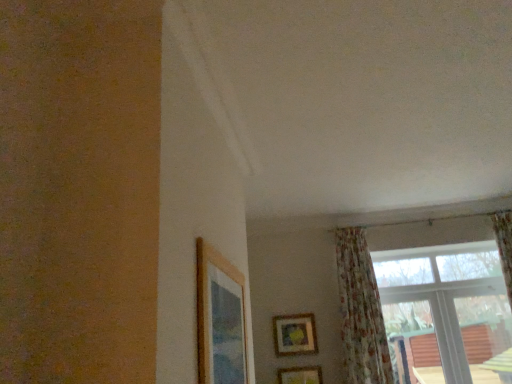
Image resolution: width=512 pixels, height=384 pixels. Describe the element at coordinates (360, 312) in the screenshot. I see `floral fabric curtain at lower right` at that location.

What do you see at coordinates (425, 310) in the screenshot?
I see `transparent glass window at upper right` at bounding box center [425, 310].

Describe the element at coordinates (220, 319) in the screenshot. The image size is (512, 384). I see `wooden picture frame at upper left, which ranks as the first picture frame in front-to-back order` at that location.

Measure the distance between wooden picture frame at lower center, the third picture frame in the front-to-back sequence, and camera.

The depth of wooden picture frame at lower center, the third picture frame in the front-to-back sequence, is 13.04 feet.

Image resolution: width=512 pixels, height=384 pixels. Describe the element at coordinates (295, 334) in the screenshot. I see `wooden picture frame at lower center, acting as the 2th picture frame starting from the bottom` at that location.

Image resolution: width=512 pixels, height=384 pixels. What are the coordinates of `floral fabric curtain at lower right` in the screenshot? It's located at (360, 312).

Considering the sizes of objects wooden picture frame at upper left, which ranks as the first picture frame in front-to-back order, and floral fabric curtain at lower right in the image provided, who is shorter, wooden picture frame at upper left, which ranks as the first picture frame in front-to-back order, or floral fabric curtain at lower right?

With less height is wooden picture frame at upper left, which ranks as the first picture frame in front-to-back order.

From the image's perspective, which is above, wooden picture frame at upper left, marked as the third picture frame in a right-to-left arrangement, or floral fabric curtain at lower right?

wooden picture frame at upper left, marked as the third picture frame in a right-to-left arrangement, is shown above in the image.

Considering the relative sizes of wooden picture frame at upper left, which ranks as the 3th picture frame in back-to-front order, and floral fabric curtain at lower right in the image provided, is wooden picture frame at upper left, which ranks as the 3th picture frame in back-to-front order, bigger than floral fabric curtain at lower right?

No, wooden picture frame at upper left, which ranks as the 3th picture frame in back-to-front order, is not bigger than floral fabric curtain at lower right.

Could you tell me if wooden picture frame at upper left, the first picture frame in the left-to-right sequence, is turned towards floral fabric curtain at lower right?

No.

Does transparent glass window at upper right come behind wooden picture frame at upper center, the first picture frame ordered from the bottom?

No, it is not.

Find the location of `picture frame that is the 2nd one when counting downward from the transparent glass window at upper right (from the image's perspective)`. picture frame that is the 2nd one when counting downward from the transparent glass window at upper right (from the image's perspective) is located at coordinates (300, 375).

Could you tell me if transparent glass window at upper right is turned towards wooden picture frame at upper center, marked as the 3th picture frame in a top-to-bottom arrangement?

No, transparent glass window at upper right is not oriented towards wooden picture frame at upper center, marked as the 3th picture frame in a top-to-bottom arrangement.

Based on the photo, which object is wider, transparent glass window at upper right or wooden picture frame at upper center, positioned as the 2th picture frame in back-to-front order?

transparent glass window at upper right is wider.

Between floral fabric curtain at lower right and wooden picture frame at upper left, which ranks as the first picture frame in front-to-back order, which one has more height?

floral fabric curtain at lower right.

Between floral fabric curtain at lower right and wooden picture frame at upper left, the first picture frame in the left-to-right sequence, which one has smaller width?

wooden picture frame at upper left, the first picture frame in the left-to-right sequence.

Is floral fabric curtain at lower right oriented towards wooden picture frame at upper left, which ranks as the 3th picture frame in back-to-front order?

No, floral fabric curtain at lower right is not facing towards wooden picture frame at upper left, which ranks as the 3th picture frame in back-to-front order.

Considering the sizes of floral fabric curtain at lower right and wooden picture frame at upper left, which appears as the first picture frame when viewed from the top, in the image, is floral fabric curtain at lower right bigger or smaller than wooden picture frame at upper left, which appears as the first picture frame when viewed from the top,?

Clearly, floral fabric curtain at lower right is larger in size than wooden picture frame at upper left, which appears as the first picture frame when viewed from the top.

Measure the distance from wooden picture frame at upper left, which ranks as the first picture frame in front-to-back order, to transparent glass window at upper right.

A distance of 8.07 feet exists between wooden picture frame at upper left, which ranks as the first picture frame in front-to-back order, and transparent glass window at upper right.

Is wooden picture frame at upper left, marked as the third picture frame in a right-to-left arrangement, spatially inside transparent glass window at upper right, or outside of it?

wooden picture frame at upper left, marked as the third picture frame in a right-to-left arrangement, is spatially situated outside transparent glass window at upper right.

Considering the positions of points (211, 270) and (498, 338), is point (211, 270) closer to camera compared to point (498, 338)?

Yes, it is in front of point (498, 338).

Is wooden picture frame at upper left, arranged as the third picture frame when ordered from the bottom, next to transparent glass window at upper right and touching it?

There is a gap between wooden picture frame at upper left, arranged as the third picture frame when ordered from the bottom, and transparent glass window at upper right.

Is wooden picture frame at lower center, which is counted as the second picture frame, starting from the right, directly adjacent to wooden picture frame at upper left, which ranks as the 3th picture frame in back-to-front order?

No.

Locate an element on the screen. The image size is (512, 384). the 1st picture frame counting from the right of the wooden picture frame at upper left, which ranks as the first picture frame in front-to-back order is located at coordinates (295, 334).

Considering the relative positions of wooden picture frame at lower center, which is counted as the second picture frame, starting from the right, and wooden picture frame at upper left, which ranks as the first picture frame in front-to-back order, in the image provided, is wooden picture frame at lower center, which is counted as the second picture frame, starting from the right, to the left of wooden picture frame at upper left, which ranks as the first picture frame in front-to-back order, from the viewer's perspective?

In fact, wooden picture frame at lower center, which is counted as the second picture frame, starting from the right, is to the right of wooden picture frame at upper left, which ranks as the first picture frame in front-to-back order.

At what (x,y) coordinates should I click in order to perform the action: click on picture frame on the right side of wooden picture frame at lower center, acting as the 2th picture frame starting from the bottom. Please return your answer as a coordinate pair (x, y). The image size is (512, 384). Looking at the image, I should click on (300, 375).

From a real-world perspective, does wooden picture frame at upper center, positioned as the 1th picture frame in right-to-left order, sit lower than wooden picture frame at lower center, which is counted as the second picture frame, starting from the top?

Yes, from a real-world perspective, wooden picture frame at upper center, positioned as the 1th picture frame in right-to-left order, is below wooden picture frame at lower center, which is counted as the second picture frame, starting from the top.

Measure the distance between wooden picture frame at upper center, marked as the 3th picture frame in a top-to-bottom arrangement, and wooden picture frame at lower center, which is counted as the second picture frame, starting from the top.

wooden picture frame at upper center, marked as the 3th picture frame in a top-to-bottom arrangement, is 10.57 inches away from wooden picture frame at lower center, which is counted as the second picture frame, starting from the top.

Which is in front, wooden picture frame at upper center, positioned as the 2th picture frame in back-to-front order, or wooden picture frame at lower center, the third picture frame in the front-to-back sequence?

Positioned in front is wooden picture frame at upper center, positioned as the 2th picture frame in back-to-front order.

Is wooden picture frame at upper center, the first picture frame ordered from the bottom, in front of or behind floral fabric curtain at lower right in the image?

Visually, wooden picture frame at upper center, the first picture frame ordered from the bottom, is located behind floral fabric curtain at lower right.

Which of these two, wooden picture frame at upper center, positioned as the 2th picture frame in back-to-front order, or floral fabric curtain at lower right, is bigger?

Bigger between the two is floral fabric curtain at lower right.

In the scene shown: Based on their positions, is wooden picture frame at upper center, the 2th picture frame when ordered from front to back, located to the left or right of floral fabric curtain at lower right?

From the image, it's evident that wooden picture frame at upper center, the 2th picture frame when ordered from front to back, is to the left of floral fabric curtain at lower right.

Locate an element on the screen. the 3rd picture frame counting from the left of the floral fabric curtain at lower right is located at coordinates (220, 319).

Where is `the 2nd picture frame below the transparent glass window at upper right (from the image's perspective)`? the 2nd picture frame below the transparent glass window at upper right (from the image's perspective) is located at coordinates (300, 375).

Based on their spatial positions, is floral fabric curtain at lower right or wooden picture frame at upper center, the first picture frame ordered from the bottom, closer to transparent glass window at upper right?

floral fabric curtain at lower right is positioned closer to the anchor transparent glass window at upper right.

Which object lies nearer to the anchor point wooden picture frame at upper left, arranged as the third picture frame when ordered from the bottom, wooden picture frame at upper center, marked as the 3th picture frame in a top-to-bottom arrangement, or floral fabric curtain at lower right?

floral fabric curtain at lower right is closer to wooden picture frame at upper left, arranged as the third picture frame when ordered from the bottom.

Considering their positions, is wooden picture frame at upper left, arranged as the third picture frame when ordered from the bottom, positioned closer to wooden picture frame at lower center, which is the 2th picture frame from left to right, than transparent glass window at upper right?

The object closer to wooden picture frame at lower center, which is the 2th picture frame from left to right, is transparent glass window at upper right.

Based on their spatial positions, is wooden picture frame at upper left, which ranks as the 3th picture frame in back-to-front order, or wooden picture frame at lower center, acting as the 2th picture frame starting from the bottom, further from floral fabric curtain at lower right?

wooden picture frame at upper left, which ranks as the 3th picture frame in back-to-front order, is further to floral fabric curtain at lower right.

Considering their positions, is wooden picture frame at lower center, which is counted as the second picture frame, starting from the top, positioned closer to floral fabric curtain at lower right than wooden picture frame at upper left, marked as the third picture frame in a right-to-left arrangement?

wooden picture frame at lower center, which is counted as the second picture frame, starting from the top, is positioned closer to the anchor floral fabric curtain at lower right.

Which object lies nearer to the anchor point wooden picture frame at upper center, the 2th picture frame when ordered from front to back, floral fabric curtain at lower right or wooden picture frame at lower center, which is counted as the second picture frame, starting from the top?

wooden picture frame at lower center, which is counted as the second picture frame, starting from the top, is positioned closer to the anchor wooden picture frame at upper center, the 2th picture frame when ordered from front to back.

Which object lies nearer to the anchor point wooden picture frame at upper left, which appears as the first picture frame when viewed from the top, wooden picture frame at lower center, acting as the 2th picture frame starting from the bottom, or transparent glass window at upper right?

wooden picture frame at lower center, acting as the 2th picture frame starting from the bottom, is positioned closer to the anchor wooden picture frame at upper left, which appears as the first picture frame when viewed from the top.

Which object lies nearer to the anchor point wooden picture frame at lower center, which is counted as the second picture frame, starting from the right, transparent glass window at upper right or floral fabric curtain at lower right?

floral fabric curtain at lower right.

At what (x,y) coordinates should I click in order to perform the action: click on curtain between wooden picture frame at upper left, which ranks as the 3th picture frame in back-to-front order, and transparent glass window at upper right from front to back. Please return your answer as a coordinate pair (x, y). The height and width of the screenshot is (384, 512). Looking at the image, I should click on (360, 312).

In order to click on picture frame between floral fabric curtain at lower right and wooden picture frame at upper center, marked as the 3th picture frame in a top-to-bottom arrangement, in the vertical direction in this screenshot , I will do (295, 334).

Identify the location of picture frame between wooden picture frame at upper left, which ranks as the first picture frame in front-to-back order, and wooden picture frame at lower center, arranged as the 1th picture frame when viewed from the back, along the z-axis. (300, 375).

This screenshot has width=512, height=384. I want to click on curtain between wooden picture frame at lower center, which is counted as the second picture frame, starting from the right, and transparent glass window at upper right, so click(x=360, y=312).